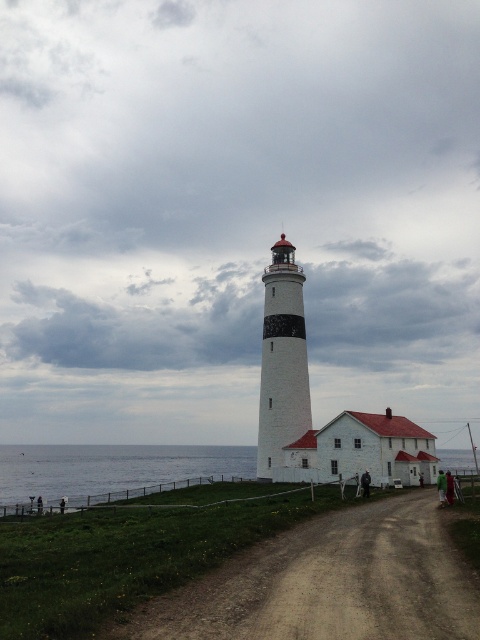
Question: Where is brown dirt track at center located in relation to blue water at lower left in the image?

Choices:
 (A) right
 (B) left

Answer: (A)

Question: Can you confirm if brown dirt track at center is positioned to the left of blue water at lower left?

Choices:
 (A) yes
 (B) no

Answer: (B)

Question: Based on their relative distances, which object is nearer to the white painted brick lighthouse at center?

Choices:
 (A) blue water at lower left
 (B) brown dirt track at center

Answer: (B)

Question: Can you confirm if blue water at lower left is bigger than white painted brick lighthouse at center?

Choices:
 (A) yes
 (B) no

Answer: (A)

Question: Among these objects, which one is farthest from the camera?

Choices:
 (A) blue water at lower left
 (B) white painted brick lighthouse at center
 (C) brown dirt track at center

Answer: (A)

Question: Which point is farther to the camera?

Choices:
 (A) white painted brick lighthouse at center
 (B) blue water at lower left

Answer: (B)